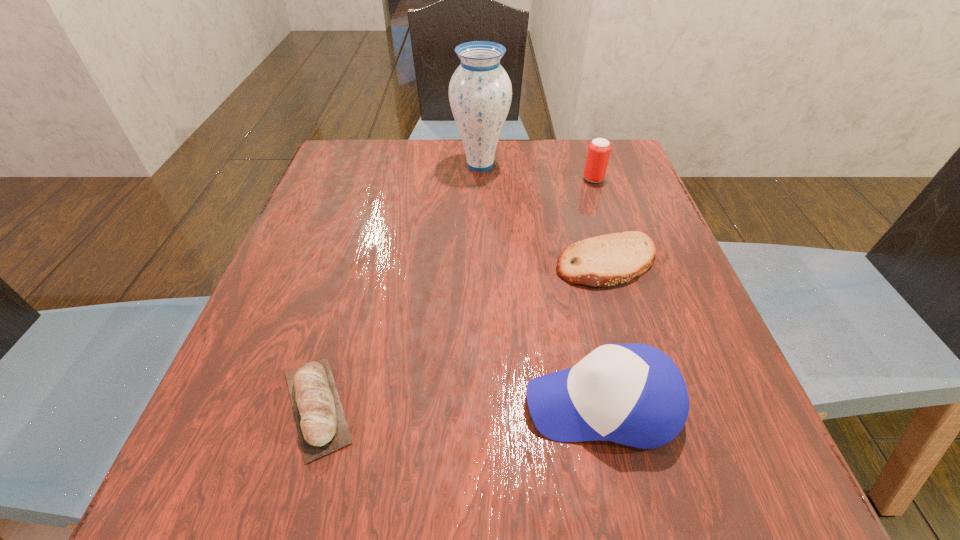
This screenshot has height=540, width=960. I want to click on vacant space at the far right corner of the desktop, so (590, 189).

Find the location of `blank region between the baseball cap and the nearer pita bread`. blank region between the baseball cap and the nearer pita bread is located at coordinates (460, 405).

I want to click on vacant area that lies between the vase and the leftmost object, so click(398, 286).

Locate an element on the screen. The width and height of the screenshot is (960, 540). free space between the beer can and the leftmost object is located at coordinates (455, 293).

The width and height of the screenshot is (960, 540). In order to click on free space between the beer can and the baseball cap in this screenshot , I will do `click(598, 292)`.

The height and width of the screenshot is (540, 960). I want to click on vacant area between the left pita bread and the vase, so click(398, 286).

This screenshot has height=540, width=960. In order to click on vacant space in between the nearer pita bread and the beer can in this screenshot , I will do `click(455, 293)`.

Where is `unoccupied position between the baseball cap and the tallest object`? This screenshot has width=960, height=540. unoccupied position between the baseball cap and the tallest object is located at coordinates (x=541, y=285).

At what (x,y) coordinates should I click in order to perform the action: click on empty location between the baseball cap and the leftmost object. Please return your answer as a coordinate pair (x, y). The image size is (960, 540). Looking at the image, I should click on coord(460,405).

Where is `free space between the beer can and the baseball cap`? The height and width of the screenshot is (540, 960). free space between the beer can and the baseball cap is located at coordinates (598, 292).